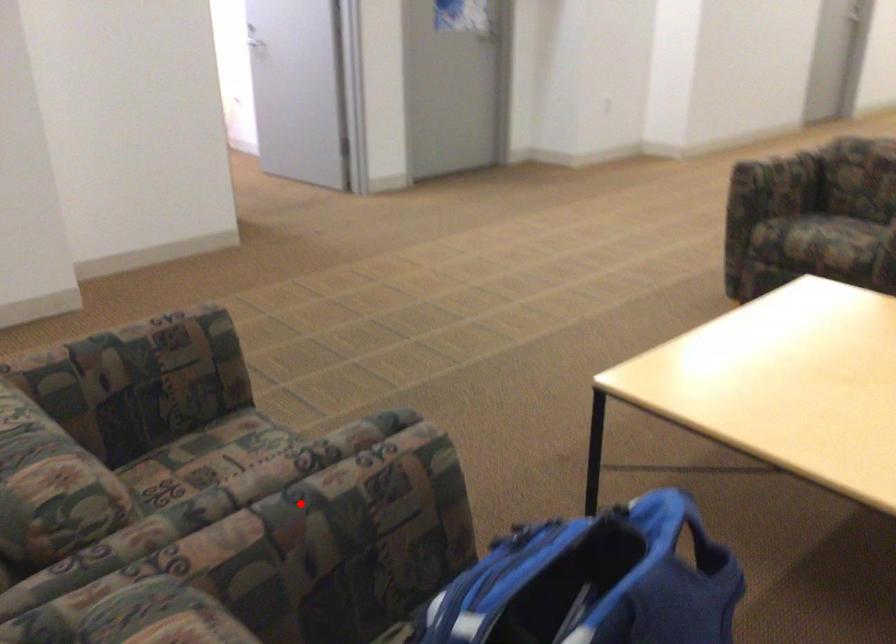
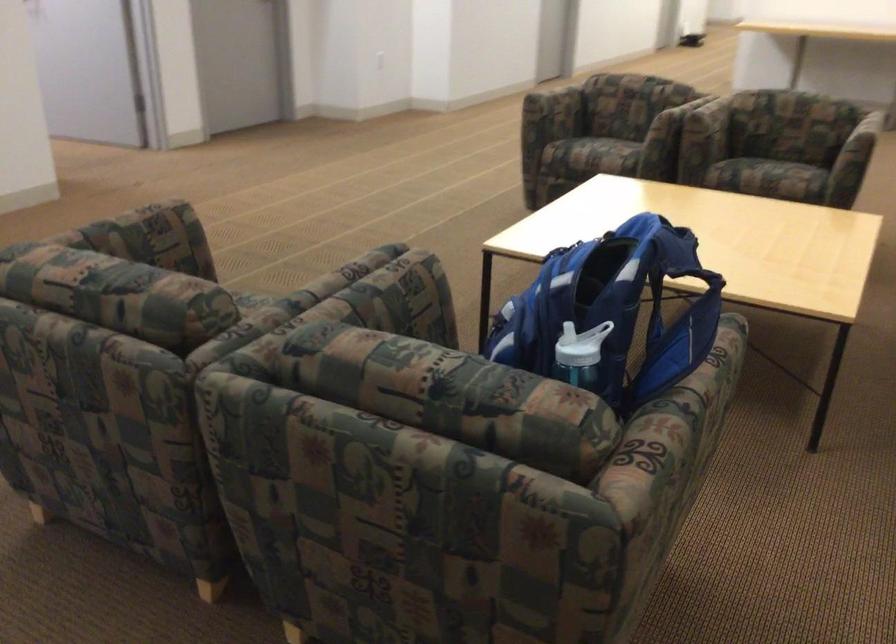
Find the pixel in the second image that matches the highlighted location in the first image.

(362, 292)